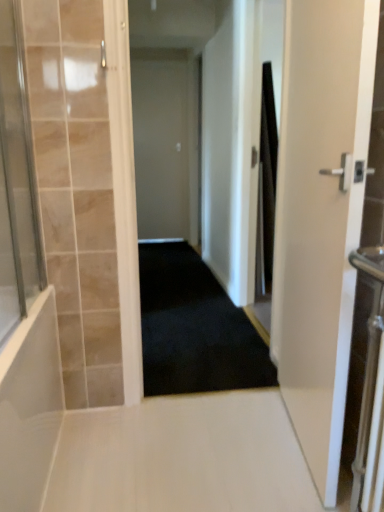
Locate an element on the screen. The height and width of the screenshot is (512, 384). free space to the left of white glossy door at right, placed as the first door when sorted from right to left is located at coordinates (201, 451).